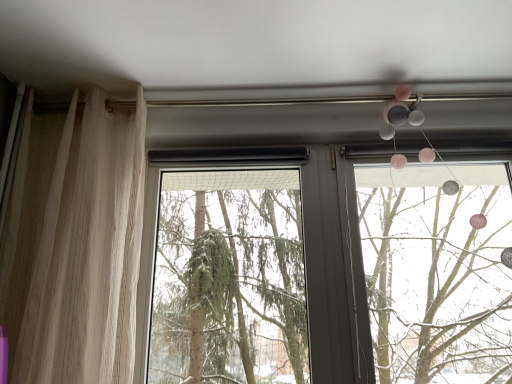
The width and height of the screenshot is (512, 384). What do you see at coordinates (437, 272) in the screenshot? I see `matte plastic mobile at upper right` at bounding box center [437, 272].

What do you see at coordinates (74, 243) in the screenshot? I see `sheer beige curtain at left` at bounding box center [74, 243].

Where is `matte plastic mobile at upper right`? The width and height of the screenshot is (512, 384). matte plastic mobile at upper right is located at coordinates (437, 272).

Is point (254, 356) closer or farther from the camera than point (396, 357)?

Clearly, point (254, 356) is closer to the camera than point (396, 357).

Can you confirm if green matte tree at center is taller than matte plastic mobile at upper right?

In fact, green matte tree at center may be shorter than matte plastic mobile at upper right.

Locate an element on the screen. The height and width of the screenshot is (384, 512). tree below the matte plastic mobile at upper right (from the image's perspective) is located at coordinates (229, 289).

Is green matte tree at center oriented away from matte plastic mobile at upper right?

No, matte plastic mobile at upper right is not at the back of green matte tree at center.

Where is `curtain on the left of green matte tree at center`? The width and height of the screenshot is (512, 384). curtain on the left of green matte tree at center is located at coordinates (74, 243).

Which is nearer, [269,246] or [127,142]?

The point [127,142] is in front.

From a real-world perspective, is green matte tree at center positioned above or below sheer beige curtain at left?

green matte tree at center is below sheer beige curtain at left.

Does sheer beige curtain at left have a greater height compared to matte plastic mobile at upper right?

Yes, sheer beige curtain at left is taller than matte plastic mobile at upper right.

Is sheer beige curtain at left not close to matte plastic mobile at upper right?

sheer beige curtain at left is positioned a significant distance from matte plastic mobile at upper right.

From the image's perspective, is sheer beige curtain at left located above matte plastic mobile at upper right?

Yes, from the image's perspective, sheer beige curtain at left is on top of matte plastic mobile at upper right.

From a real-world perspective, is sheer beige curtain at left on matte plastic mobile at upper right?

Yes, from a real-world perspective, sheer beige curtain at left is over matte plastic mobile at upper right

How distant is matte plastic mobile at upper right from green matte tree at center?

matte plastic mobile at upper right is 32.37 inches away from green matte tree at center.

Is matte plastic mobile at upper right spatially inside green matte tree at center, or outside of it?

matte plastic mobile at upper right lies outside green matte tree at center.

Find the location of a particular element. The height and width of the screenshot is (384, 512). window frame above the green matte tree at center (from a real-world perspective) is located at coordinates (437, 272).

From a real-world perspective, is matte plastic mobile at upper right located higher than green matte tree at center?

Yes, from a real-world perspective, matte plastic mobile at upper right is on top of green matte tree at center.

Identify the location of tree below the sheer beige curtain at left (from the image's perspective). (229, 289).

Between sheer beige curtain at left and green matte tree at center, which one appears on the left side from the viewer's perspective?

sheer beige curtain at left.

Which is in front, point (54, 322) or point (302, 264)?

The point (54, 322) is closer.

Does sheer beige curtain at left have a lesser height compared to green matte tree at center?

Incorrect, the height of sheer beige curtain at left does not fall short of that of green matte tree at center.

Consider the image. From the image's perspective, relative to sheer beige curtain at left, is matte plastic mobile at upper right above or below?

matte plastic mobile at upper right is below sheer beige curtain at left.

Is sheer beige curtain at left a part of matte plastic mobile at upper right?

No, sheer beige curtain at left is not a part of matte plastic mobile at upper right.

Is matte plastic mobile at upper right aimed at sheer beige curtain at left?

No, matte plastic mobile at upper right is not oriented towards sheer beige curtain at left.

Find the location of a particular element. The width and height of the screenshot is (512, 384). tree that is under the matte plastic mobile at upper right (from a real-world perspective) is located at coordinates (229, 289).

At what (x,y) coordinates should I click in order to perform the action: click on curtain to the left of green matte tree at center. Please return your answer as a coordinate pair (x, y). Looking at the image, I should click on (74, 243).

Considering their positions, is green matte tree at center positioned further to sheer beige curtain at left than matte plastic mobile at upper right?

Based on the image, matte plastic mobile at upper right appears to be further to sheer beige curtain at left.

Looking at the image, which one is located closer to matte plastic mobile at upper right, green matte tree at center or sheer beige curtain at left?

The object closer to matte plastic mobile at upper right is green matte tree at center.

Looking at this image, when comparing their distances from sheer beige curtain at left, does matte plastic mobile at upper right or green matte tree at center seem closer?

green matte tree at center lies closer to sheer beige curtain at left than the other object.

Considering their positions, is sheer beige curtain at left positioned closer to green matte tree at center than matte plastic mobile at upper right?

The object closer to green matte tree at center is matte plastic mobile at upper right.

When comparing their distances from matte plastic mobile at upper right, does sheer beige curtain at left or green matte tree at center seem closer?

green matte tree at center is positioned closer to the anchor matte plastic mobile at upper right.

Which object lies further to the anchor point green matte tree at center, matte plastic mobile at upper right or sheer beige curtain at left?

sheer beige curtain at left is further to green matte tree at center.

Find the location of a particular element. tree situated between sheer beige curtain at left and matte plastic mobile at upper right from left to right is located at coordinates (229, 289).